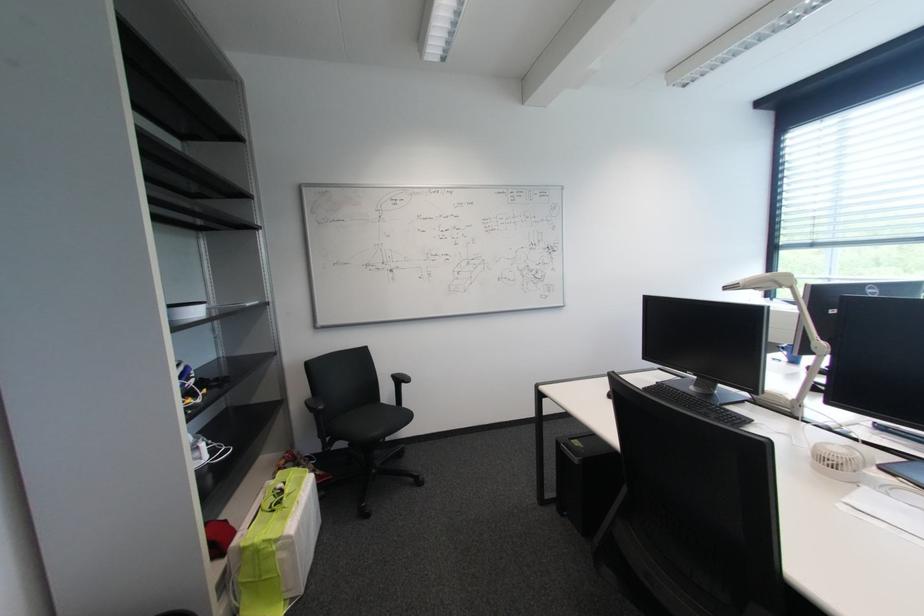
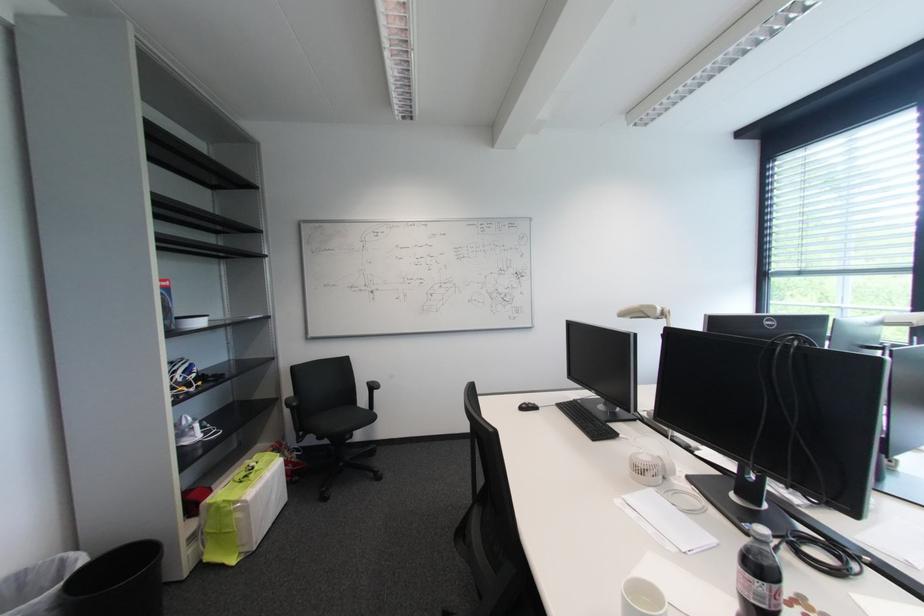
Find the pixel in the second image that matches point 355,445 in the first image.

(322, 438)